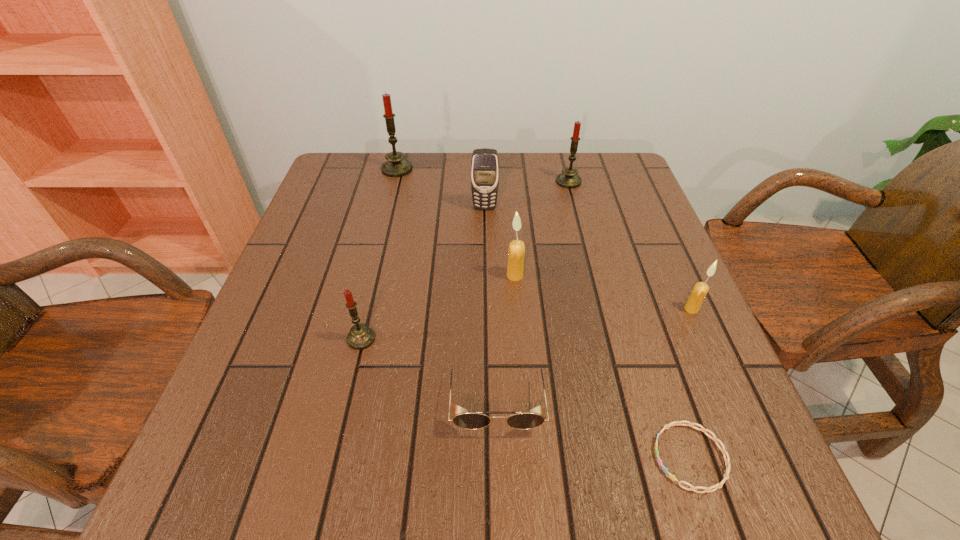
Locate an element on the screen. This screenshot has width=960, height=540. vacant space located on the front lenses of the sunglasses is located at coordinates (499, 489).

The image size is (960, 540). Find the location of `free space located on the surface of the shortest object showing star-shaped elements`. free space located on the surface of the shortest object showing star-shaped elements is located at coordinates (604, 457).

Image resolution: width=960 pixels, height=540 pixels. Find the location of `free space located on the surface of the shortest object showing star-shaped elements`. free space located on the surface of the shortest object showing star-shaped elements is located at coordinates (397, 457).

The width and height of the screenshot is (960, 540). What are the coordinates of `blank area located 0.160m on the surface of the shortest object showing star-shaped elements` in the screenshot? It's located at (552, 457).

The height and width of the screenshot is (540, 960). I want to click on object present at the near edge, so click(727, 461).

Locate an element on the screen. Image resolution: width=960 pixels, height=540 pixels. object at the left edge is located at coordinates (396, 166).

Identify the location of bracelet that is positioned at the right edge. The image size is (960, 540). (727, 461).

Where is `object at the far left corner`? This screenshot has height=540, width=960. object at the far left corner is located at coordinates (396, 166).

I want to click on object present at the far right corner, so click(x=568, y=178).

You are a GUI agent. You are given a task and a screenshot of the screen. Output one action in this format:
    pyautogui.click(x=<x>, y=<y>)
    Task: Click on the object that is at the near right corner
    Image resolution: width=960 pixels, height=540 pixels.
    Given the screenshot: What is the action you would take?
    pyautogui.click(x=727, y=461)